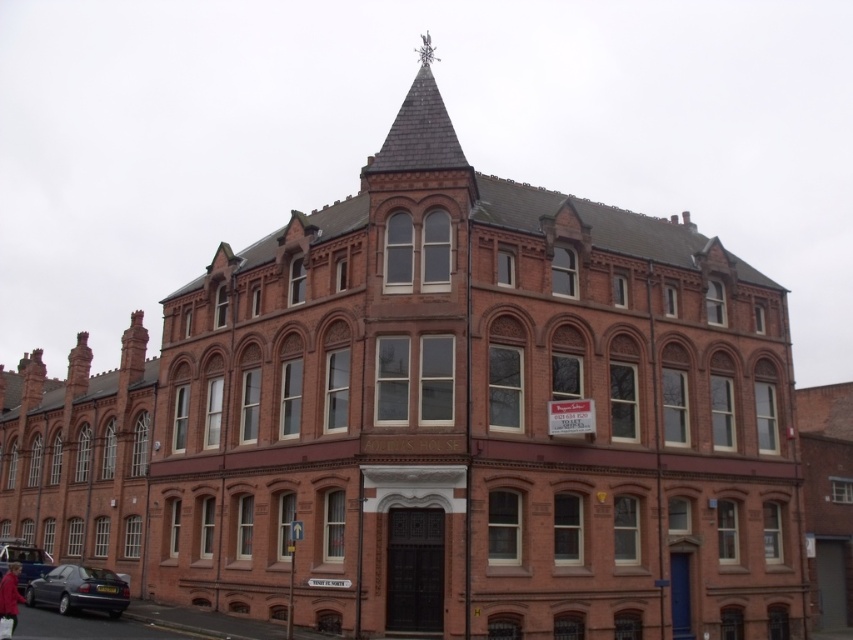
Which is more to the left, shiny slate spire at upper center or matte black car at lower left?

matte black car at lower left is more to the left.

Does shiny slate spire at upper center lie in front of matte black car at lower left?

Yes.

Does point (412, 160) come closer to viewer compared to point (38, 548)?

Yes, it is in front of point (38, 548).

The height and width of the screenshot is (640, 853). Find the location of `shiny slate spire at upper center`. shiny slate spire at upper center is located at coordinates (419, 129).

Consider the image. Can you confirm if shiny slate spire at upper center is wider than metallic blue sedan at lower left?

Incorrect, shiny slate spire at upper center's width does not surpass metallic blue sedan at lower left's.

Consider the image. Is shiny slate spire at upper center shorter than metallic blue sedan at lower left?

In fact, shiny slate spire at upper center may be taller than metallic blue sedan at lower left.

Between point (405, 161) and point (73, 584), which one is positioned in front?

Positioned in front is point (405, 161).

What are the coordinates of `shiny slate spire at upper center` in the screenshot? It's located at tap(419, 129).

Does metallic blue sedan at lower left have a larger size compared to red fabric coat at lower left?

No, metallic blue sedan at lower left is not bigger than red fabric coat at lower left.

Describe the element at coordinates (79, 589) in the screenshot. The image size is (853, 640). I see `metallic blue sedan at lower left` at that location.

What do you see at coordinates (79, 589) in the screenshot? This screenshot has height=640, width=853. I see `metallic blue sedan at lower left` at bounding box center [79, 589].

Locate an element on the screen. metallic blue sedan at lower left is located at coordinates (79, 589).